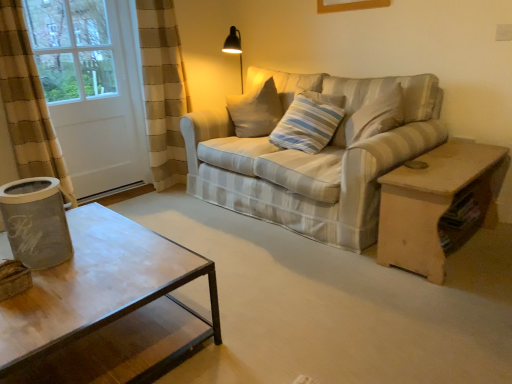
Identify the location of vacant space in front of light brown wooden table at right. The image size is (512, 384). (450, 312).